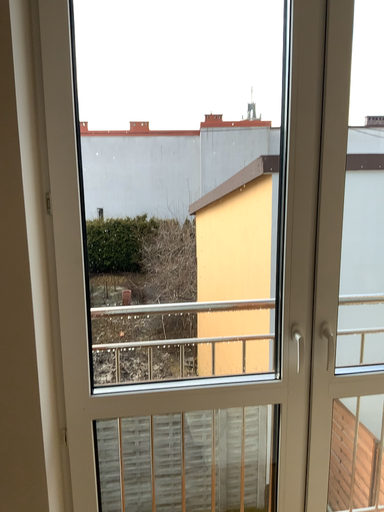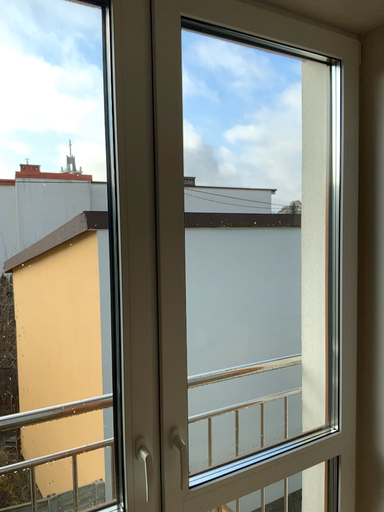
Question: How did the camera likely rotate when shooting the video?

Choices:
 (A) rotated upward
 (B) rotated downward

Answer: (A)